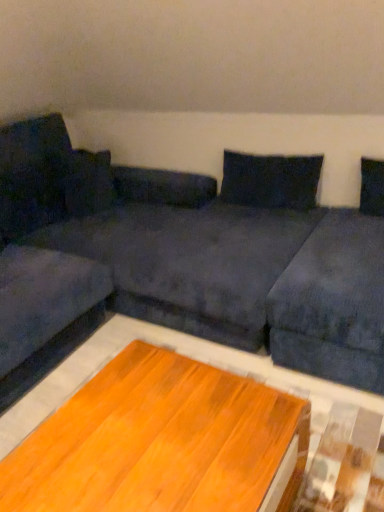
Where is `dark blue fabric couch at center`? dark blue fabric couch at center is located at coordinates (194, 256).

Locate an element on the screen. Image resolution: width=384 pixels, height=512 pixels. wooden table at center is located at coordinates (159, 442).

The height and width of the screenshot is (512, 384). I want to click on couch that is below the dark blue fabric pillow at upper center (from the image's perspective), so click(x=43, y=298).

Looking at their sizes, would you say dark blue fabric pillow at upper center is wider or thinner than velvet dark blue couch at left?

Considering their sizes, dark blue fabric pillow at upper center looks slimmer than velvet dark blue couch at left.

Can velvet dark blue couch at left be found inside dark blue fabric pillow at upper center?

No, velvet dark blue couch at left is not inside dark blue fabric pillow at upper center.

Are dark blue fabric pillow at upper center and velvet dark blue couch at left located far from each other?

Yes, dark blue fabric pillow at upper center and velvet dark blue couch at left are located far from each other.

Is velvet dark blue couch at left directly adjacent to dark blue fabric pillow at upper center?

No, velvet dark blue couch at left is not in contact with dark blue fabric pillow at upper center.

In the scene shown: Would you say velvet dark blue couch at left is to the left or to the right of dark blue fabric pillow at upper center in the picture?

In the image, velvet dark blue couch at left appears on the left side of dark blue fabric pillow at upper center.

Is velvet dark blue couch at left turned away from dark blue fabric pillow at upper center?

No, velvet dark blue couch at left is not facing the opposite direction of dark blue fabric pillow at upper center.

Can you tell me how much velvet dark blue couch at left and dark blue fabric pillow at upper center differ in facing direction?

The angular difference between velvet dark blue couch at left and dark blue fabric pillow at upper center is 87.9 degrees.

From the image's perspective, between dark blue fabric couch at center and velvet dark blue couch at left, which one is located above?

From the image's view, dark blue fabric couch at center is above.

From a real-world perspective, is dark blue fabric couch at center under velvet dark blue couch at left?

Actually, dark blue fabric couch at center is physically above velvet dark blue couch at left in the real world.

Who is shorter, dark blue fabric couch at center or velvet dark blue couch at left?

velvet dark blue couch at left.

Locate an element on the screen. Image resolution: width=384 pixels, height=512 pixels. studio couch in front of the velvet dark blue couch at left is located at coordinates (194, 256).

What are the coordinates of `studio couch that is under the dark blue fabric pillow at upper center (from a real-world perspective)` in the screenshot? It's located at (194, 256).

Considering the positions of points (148, 236) and (280, 187), is point (148, 236) farther from camera compared to point (280, 187)?

That is False.

Can you confirm if dark blue fabric couch at center is positioned to the left of dark blue fabric pillow at upper center?

Yes, dark blue fabric couch at center is to the left of dark blue fabric pillow at upper center.

Does velvet dark blue couch at left have a lesser width compared to dark blue fabric couch at center?

Yes, velvet dark blue couch at left is thinner than dark blue fabric couch at center.

In the scene shown: Is velvet dark blue couch at left further to camera compared to dark blue fabric couch at center?

Yes, the depth of velvet dark blue couch at left is greater than that of dark blue fabric couch at center.

Is velvet dark blue couch at left positioned far away from dark blue fabric couch at center?

No.

Between velvet dark blue couch at left and dark blue fabric couch at center, which one appears on the right side from the viewer's perspective?

dark blue fabric couch at center.

Relative to wooden table at center, is velvet dark blue couch at left in front or behind?

In the image, velvet dark blue couch at left appears behind wooden table at center.

From the image's perspective, between velvet dark blue couch at left and wooden table at center, which one is located above?

velvet dark blue couch at left is shown above in the image.

Considering the relative sizes of velvet dark blue couch at left and wooden table at center in the image provided, is velvet dark blue couch at left wider than wooden table at center?

Yes.

Does velvet dark blue couch at left have a greater height compared to wooden table at center?

Yes, velvet dark blue couch at left is taller than wooden table at center.

From the image's perspective, which one is positioned lower, dark blue fabric couch at center or wooden table at center?

From the image's view, wooden table at center is below.

Which is further, (20,195) or (38,446)?

The point (20,195) is behind.

Is wooden table at center inside dark blue fabric couch at center?

Yes, wooden table at center is a part of dark blue fabric couch at center.

Find the location of a particular element. The height and width of the screenshot is (512, 384). pillow that appears behind the velvet dark blue couch at left is located at coordinates (270, 180).

I want to click on couch in front of the dark blue fabric pillow at upper center, so click(x=43, y=298).

Considering their positions, is wooden table at center positioned further to dark blue fabric couch at center than velvet dark blue couch at left?

wooden table at center.

Based on their spatial positions, is dark blue fabric pillow at upper center or dark blue fabric couch at center closer to velvet dark blue couch at left?

Based on the image, dark blue fabric couch at center appears to be nearer to velvet dark blue couch at left.

Estimate the real-world distances between objects in this image. Which object is further from dark blue fabric pillow at upper center, dark blue fabric couch at center or velvet dark blue couch at left?

velvet dark blue couch at left is further to dark blue fabric pillow at upper center.

Based on their spatial positions, is dark blue fabric couch at center or dark blue fabric pillow at upper center further from wooden table at center?

Among the two, dark blue fabric pillow at upper center is located further to wooden table at center.

Considering their positions, is velvet dark blue couch at left positioned further to dark blue fabric pillow at upper center than dark blue fabric couch at center?

Among the two, velvet dark blue couch at left is located further to dark blue fabric pillow at upper center.

Considering their positions, is dark blue fabric pillow at upper center positioned closer to wooden table at center than dark blue fabric couch at center?

dark blue fabric couch at center is closer to wooden table at center.

Looking at the image, which one is located closer to dark blue fabric couch at center, velvet dark blue couch at left or wooden table at center?

The object closer to dark blue fabric couch at center is velvet dark blue couch at left.

From the image, which object appears to be nearer to dark blue fabric pillow at upper center, velvet dark blue couch at left or wooden table at center?

Based on the image, velvet dark blue couch at left appears to be nearer to dark blue fabric pillow at upper center.

Find the location of a particular element. The image size is (384, 512). table situated between velvet dark blue couch at left and dark blue fabric pillow at upper center from left to right is located at coordinates (159, 442).

Locate an element on the screen. The width and height of the screenshot is (384, 512). couch between dark blue fabric couch at center and dark blue fabric pillow at upper center in the front-back direction is located at coordinates (43, 298).

The height and width of the screenshot is (512, 384). Identify the location of table located between dark blue fabric couch at center and velvet dark blue couch at left in the depth direction. tap(159, 442).

Image resolution: width=384 pixels, height=512 pixels. What are the coordinates of `table between dark blue fabric couch at center and dark blue fabric pillow at upper center in the front-back direction` in the screenshot? It's located at (159, 442).